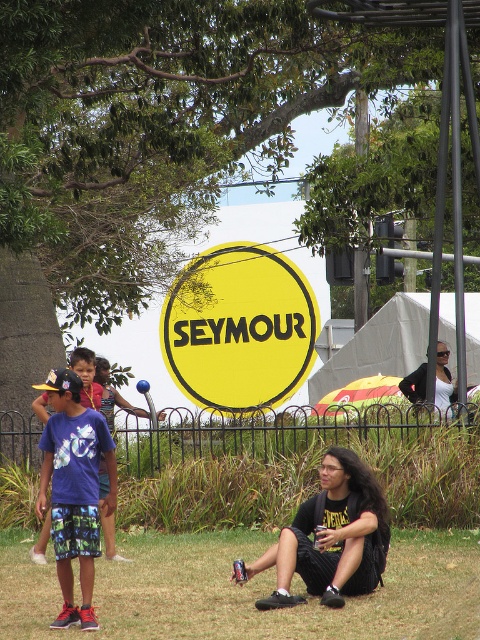
You are at the event and want to find the white matte shirt at upper right. Which direction should you move relative to the black fabric backpack at lower center?

To find the white matte shirt at upper right, you should move to the right of the black fabric backpack at lower center since the backpack is to the left of the shirt.